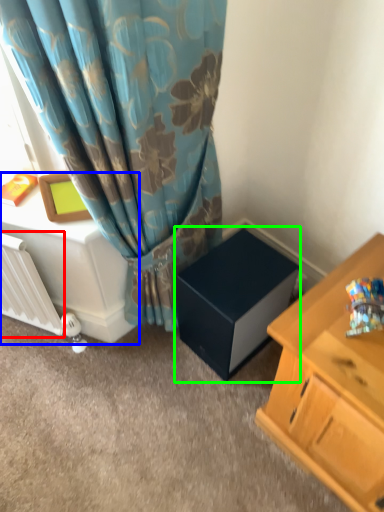
Question: Which is farther away from radiator (highlighted by a red box)? table (highlighted by a blue box) or cardboard box (highlighted by a green box)?

Choices:
 (A) table
 (B) cardboard box

Answer: (B)